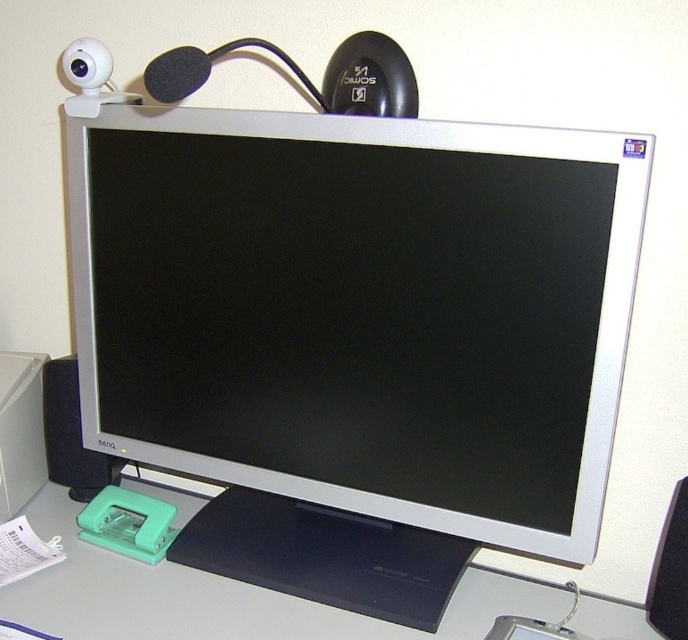
You are standing in front of the computer desk shown in the image. There is a point marked at coordinates (162, 280) on the desk. If you want to place a 100 cm ruler from your current position to that point, will the ruler fit entirely on the desk without extending beyond the desk?

The point at coordinates (162, 280) is 95.01 centimeters away from the viewer. Since the ruler is 100 cm long, it will extend 4.99 centimeters beyond the desk towards the viewer, so it won

You are organizing your workspace and want to place a new keyboard between the white matte computer desk at lower center and the black matte speaker at lower right. Based on their positions, where should you place the keyboard to ensure it is between them?

The white matte computer desk at lower center is positioned on the left side of black matte speaker at lower right, so you should place the keyboard to the left of the black matte speaker at lower right but to the right of the white matte computer desk at lower center to ensure it is between them.